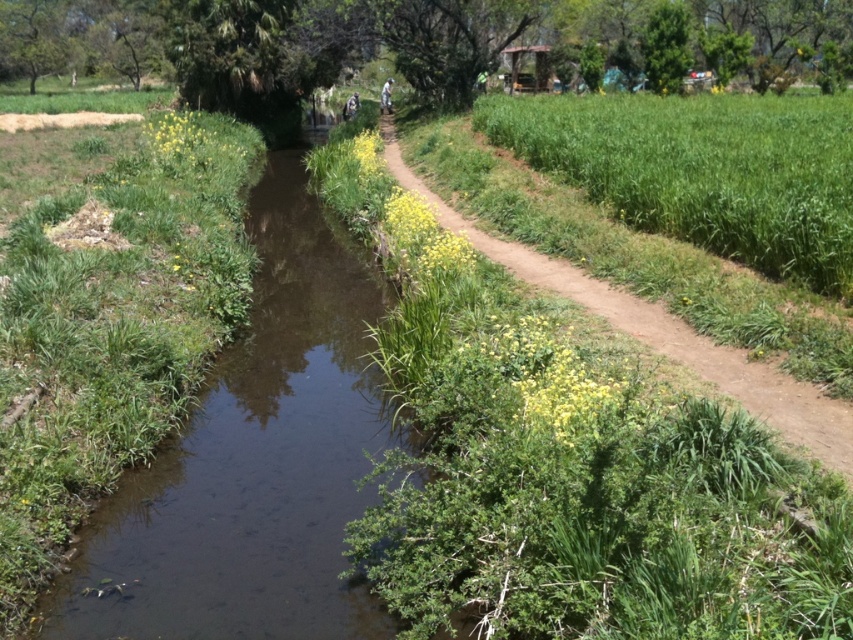
You are a hiker carrying a heavy backpack and need to cross from the brown muddy stream at center to the green grass at right. The path you choose must be at least 8 meters wide to safely carry your gear. Can you cross directly between them?

The brown muddy stream at center and green grass at right are 7.51 meters apart from each other. Since the required width is 8 meters, you cannot cross directly between them safely as the distance is insufficient.

You are standing on the dirt path next to the stream and want to cross to the other side. The point where the stream is narrowest is marked by point (254, 460). Can you cross the stream at this point?

The brown muddy stream at center is represented by point (254, 460). Since this point marks the narrowest part of the stream, it would be the easiest place to cross.